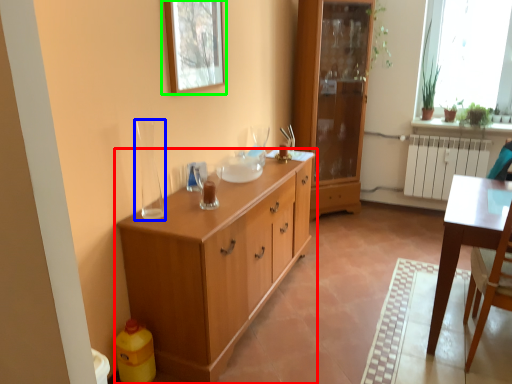
Question: Based on their relative distances, which object is farther from chest of drawers (highlighted by a red box)? Choose from glass vase (highlighted by a blue box) and picture frame (highlighted by a green box).

Choices:
 (A) glass vase
 (B) picture frame

Answer: (B)